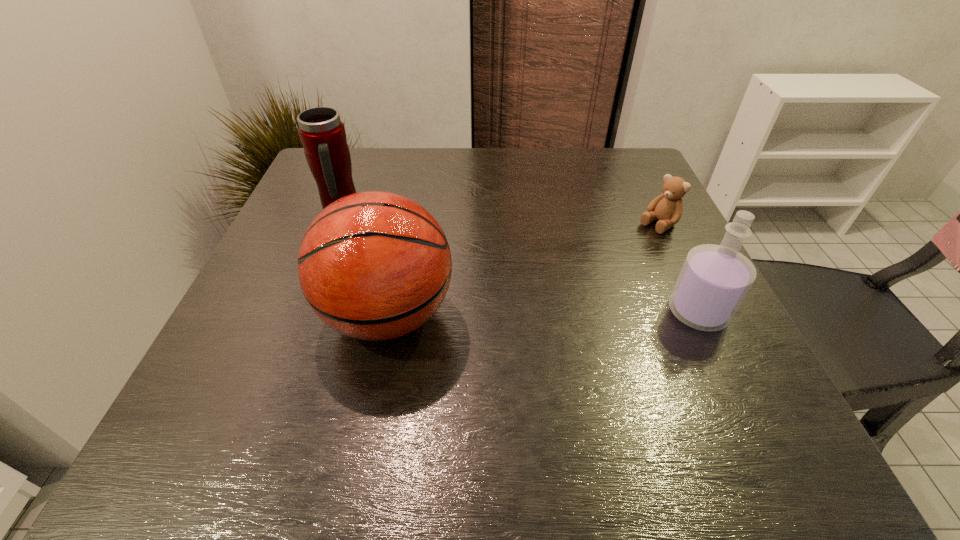
Locate an element on the screen. The height and width of the screenshot is (540, 960). free region located 0.380m on the side with the handle of the thermos bottle is located at coordinates (489, 279).

This screenshot has height=540, width=960. I want to click on vacant region located 0.260m on the front-facing side of the teddy bear, so click(571, 286).

Identify the location of vacant region located on the front-facing side of the teddy bear. (554, 298).

Where is `free space located on the front-facing side of the teddy bear`? This screenshot has height=540, width=960. free space located on the front-facing side of the teddy bear is located at coordinates (524, 319).

At what (x,y) coordinates should I click in order to perform the action: click on object that is at the far edge. Please return your answer as a coordinate pair (x, y). Looking at the image, I should click on (322, 133).

I want to click on object at the near edge, so click(x=374, y=265).

Image resolution: width=960 pixels, height=540 pixels. I want to click on basketball that is at the left edge, so click(374, 265).

Locate an element on the screen. The image size is (960, 540). thermos bottle present at the left edge is located at coordinates (322, 133).

Identify the location of perfume that is at the right edge. The image size is (960, 540). (714, 279).

Locate an element on the screen. Image resolution: width=960 pixels, height=540 pixels. teddy bear that is at the right edge is located at coordinates (667, 207).